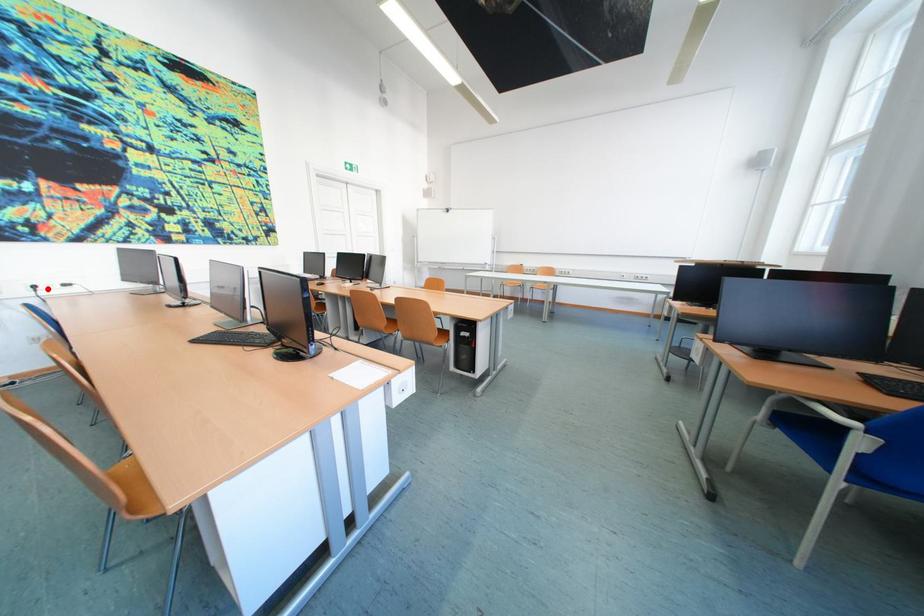
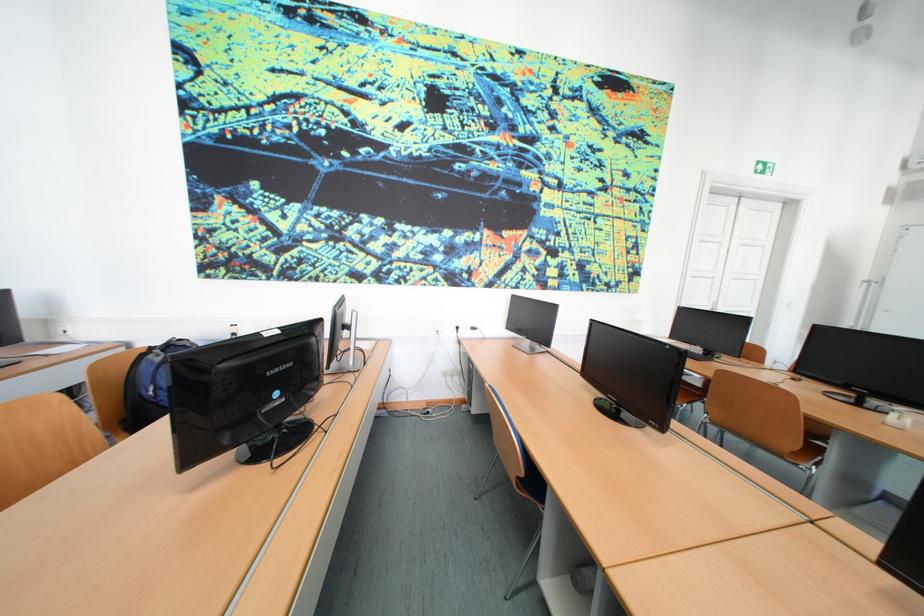
Locate, in the second image, the point that corresponds to the highlighted location in the first image.

(470, 330)